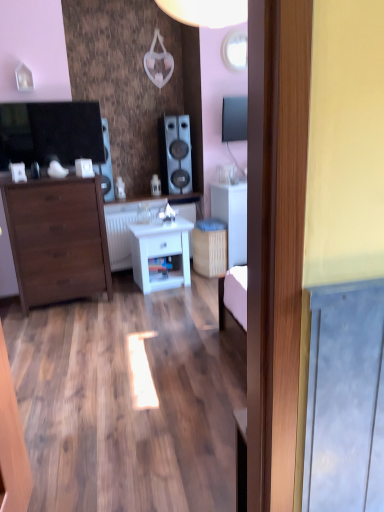
Question: Is matte black speaker at left, which appears as the first speaker when viewed from the left, smaller than white glossy counter top at center, which is counted as the 1th counter top, starting from the bottom?

Choices:
 (A) yes
 (B) no

Answer: (A)

Question: From the image's perspective, is matte black speaker at left, which appears as the first speaker when viewed from the left, over white glossy counter top at center, which is counted as the 1th counter top, starting from the bottom?

Choices:
 (A) no
 (B) yes

Answer: (B)

Question: From the image's perspective, would you say matte black speaker at left, positioned as the second speaker in right-to-left order, is shown under white glossy counter top at center, which is the 2th counter top in top-to-bottom order?

Choices:
 (A) yes
 (B) no

Answer: (B)

Question: Is matte black speaker at left, positioned as the second speaker in right-to-left order, not near white glossy counter top at center, which is counted as the 1th counter top, starting from the bottom?

Choices:
 (A) no
 (B) yes

Answer: (A)

Question: Does matte black speaker at left, which appears as the first speaker when viewed from the left, have a lesser height compared to white glossy counter top at center, which is counted as the 1th counter top, starting from the bottom?

Choices:
 (A) yes
 (B) no

Answer: (B)

Question: Is matte black speaker at left, which appears as the first speaker when viewed from the left, outside white glossy counter top at center, which is counted as the 1th counter top, starting from the bottom?

Choices:
 (A) yes
 (B) no

Answer: (A)

Question: Does white glossy nightstand at center have a larger size compared to white glossy counter top at center, which is counted as the 1th counter top, starting from the bottom?

Choices:
 (A) no
 (B) yes

Answer: (A)

Question: Are white glossy nightstand at center and white glossy counter top at center, which is counted as the 1th counter top, starting from the bottom, far apart?

Choices:
 (A) yes
 (B) no

Answer: (B)

Question: Is white glossy nightstand at center at the right side of white glossy counter top at center, which is the 2th counter top in top-to-bottom order?

Choices:
 (A) no
 (B) yes

Answer: (B)

Question: From the image's perspective, is white glossy nightstand at center on top of white glossy counter top at center, which is counted as the 1th counter top, starting from the bottom?

Choices:
 (A) yes
 (B) no

Answer: (B)

Question: From a real-world perspective, is white glossy nightstand at center located beneath white glossy counter top at center, which is the 2th counter top in top-to-bottom order?

Choices:
 (A) yes
 (B) no

Answer: (A)

Question: From the image's perspective, is white glossy nightstand at center beneath white glossy counter top at center, which is counted as the 1th counter top, starting from the bottom?

Choices:
 (A) yes
 (B) no

Answer: (A)

Question: Can you confirm if white matte cabinet at center is smaller than satin black speaker at center, the 2th speaker when ordered from left to right?

Choices:
 (A) yes
 (B) no

Answer: (B)